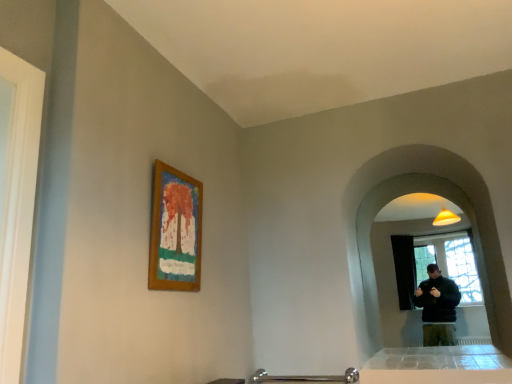
Question: Can you confirm if wooden frame at upper center is wider than matte glass mirror at right?

Choices:
 (A) no
 (B) yes

Answer: (A)

Question: Is wooden frame at upper center thinner than matte glass mirror at right?

Choices:
 (A) no
 (B) yes

Answer: (B)

Question: Is wooden frame at upper center taller than matte glass mirror at right?

Choices:
 (A) yes
 (B) no

Answer: (B)

Question: Is wooden frame at upper center facing away from matte glass mirror at right?

Choices:
 (A) yes
 (B) no

Answer: (B)

Question: Is matte glass mirror at right located within wooden frame at upper center?

Choices:
 (A) no
 (B) yes

Answer: (A)

Question: Does wooden frame at upper center turn towards matte glass mirror at right?

Choices:
 (A) yes
 (B) no

Answer: (B)

Question: Is matte glass mirror at right looking in the opposite direction of wooden frame at upper center?

Choices:
 (A) yes
 (B) no

Answer: (B)

Question: Considering the relative sizes of matte glass mirror at right and wooden frame at upper center in the image provided, is matte glass mirror at right thinner than wooden frame at upper center?

Choices:
 (A) no
 (B) yes

Answer: (A)

Question: Is matte glass mirror at right bigger than wooden frame at upper center?

Choices:
 (A) no
 (B) yes

Answer: (B)

Question: Would you say matte glass mirror at right contains wooden frame at upper center?

Choices:
 (A) yes
 (B) no

Answer: (B)

Question: Considering the relative sizes of matte glass mirror at right and wooden frame at upper center in the image provided, is matte glass mirror at right taller than wooden frame at upper center?

Choices:
 (A) no
 (B) yes

Answer: (B)

Question: From a real-world perspective, is matte glass mirror at right on wooden frame at upper center?

Choices:
 (A) yes
 (B) no

Answer: (B)

Question: Is wooden frame at upper center to the left or to the right of matte glass mirror at right in the image?

Choices:
 (A) left
 (B) right

Answer: (A)